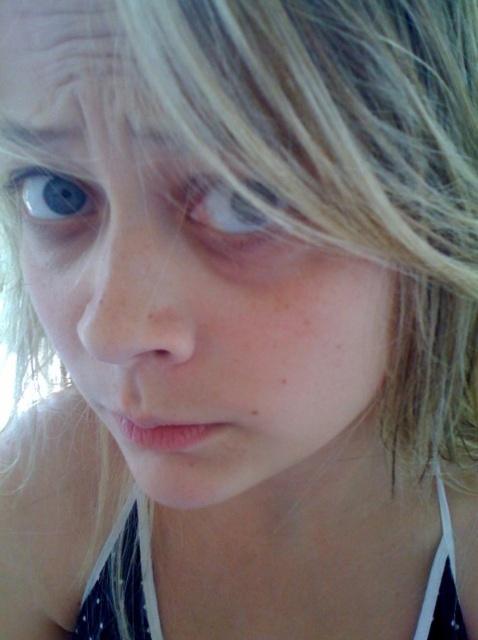
You are a photographer adjusting the focus on your camera. You notice two eyes in the frame, the translucent skin eye at center and the blue matte eye at upper left. Which eye should you focus on if you want to capture the larger one clearly?

The blue matte eye at upper left is larger, so you should focus on the blue matte eye at upper left to capture it clearly.

You are taking a photo of a person and want to focus on two points on their face. The points are labeled as point (x=128, y=497) and point (x=21, y=173). Which point should you focus on first if you want to ensure the closer one is sharp?

→ You should focus on point (x=128, y=497) first because it is closer to the camera than point (x=21, y=173), ensuring the closer point is sharp.

You are a photographer trying to capture a closeup of the person in the image. You want to ensure that the white dotted fabric bikini top at lower center is centered in the frame. Given its current position at point 0.909 on the x axis and 0.257 on the y axis, what adjustment should you make to the camera to center it?

To center the white dotted fabric bikini top at lower center, you should move the camera to the left along the x axis since its current x coordinate is 0.909, which is to the right of the center point at 0.5. The y coordinate 0.257 is below the center, so moving the camera upward along the y axis would bring it into the central area.